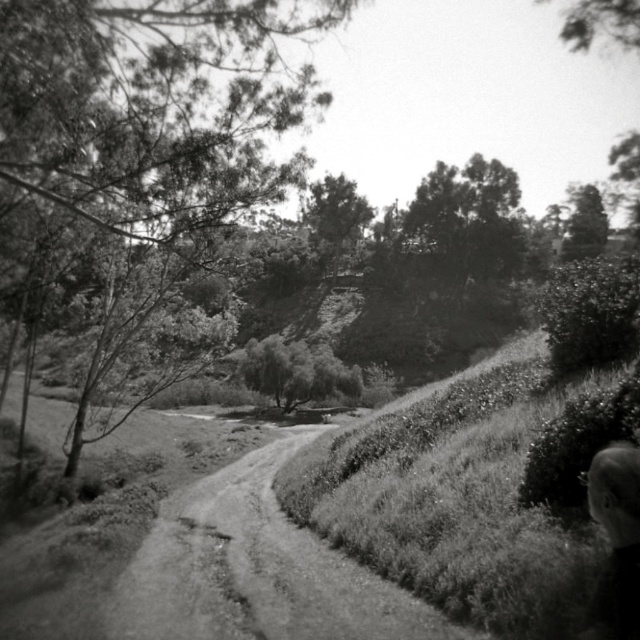
Based on the photo, does smooth green tree at center have a lesser width compared to dark gray hair at lower right?

No, smooth green tree at center is not thinner than dark gray hair at lower right.

What do you see at coordinates (154, 108) in the screenshot? I see `smooth green tree at center` at bounding box center [154, 108].

Identify the location of smooth green tree at center. The image size is (640, 640). (154, 108).

Can you confirm if dirt/gritty at center is positioned to the left of dark gray hair at lower right?

Correct, you'll find dirt/gritty at center to the left of dark gray hair at lower right.

Can you confirm if dirt/gritty at center is smaller than dark gray hair at lower right?

Incorrect, dirt/gritty at center is not smaller in size than dark gray hair at lower right.

Describe the element at coordinates (257, 570) in the screenshot. This screenshot has width=640, height=640. I see `dirt/gritty at center` at that location.

In order to click on dirt/gritty at center in this screenshot , I will do `click(257, 570)`.

Does smooth green tree at center come in front of dirt/gritty at center?

No, it is not.

Measure the distance between smooth green tree at center and camera.

smooth green tree at center and camera are 8.52 meters apart.

Describe the element at coordinates (154, 108) in the screenshot. I see `smooth green tree at center` at that location.

At what (x,y) coordinates should I click in order to perform the action: click on smooth green tree at center. Please return your answer as a coordinate pair (x, y). Looking at the image, I should click on (154, 108).